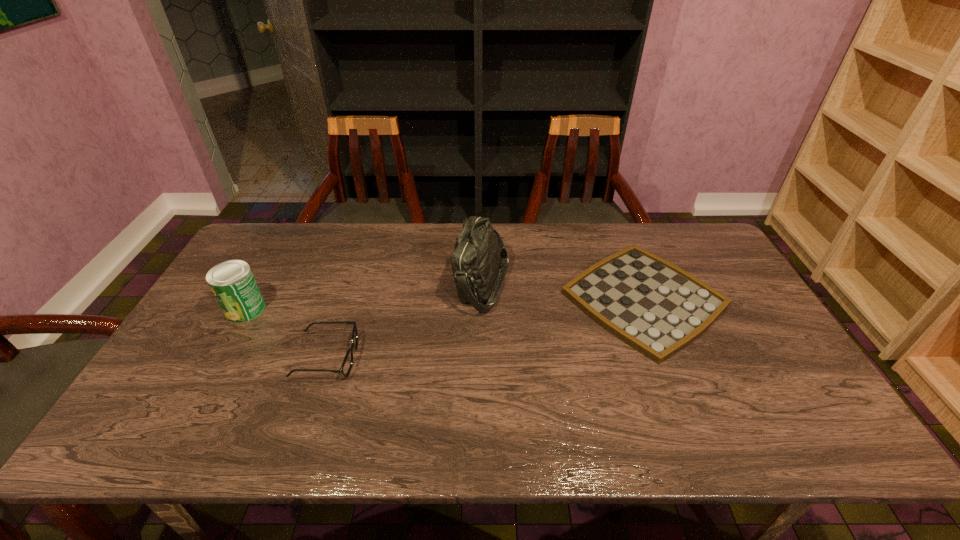
Locate an element on the screen. vacant space in between the second shortest object and the checkerboard is located at coordinates (485, 328).

This screenshot has height=540, width=960. Find the location of `free area in between the leftmost object and the shoulder bag`. free area in between the leftmost object and the shoulder bag is located at coordinates (364, 296).

Image resolution: width=960 pixels, height=540 pixels. Find the location of `free spot between the tallest object and the spectacles`. free spot between the tallest object and the spectacles is located at coordinates (404, 320).

You are a GUI agent. You are given a task and a screenshot of the screen. Output one action in this format:
    pyautogui.click(x=<x>, y=<y>)
    Task: Click on the blank region between the second shortest object and the can
    This screenshot has width=960, height=540.
    Given the screenshot: What is the action you would take?
    pyautogui.click(x=286, y=333)

Locate an element on the screen. The image size is (960, 540). object that is the third closest to the shortest object is located at coordinates (232, 282).

Identify the location of the third closest object to the rightmost object. [x=232, y=282].

You are a GUI agent. You are given a task and a screenshot of the screen. Output one action in this format:
    pyautogui.click(x=<x>, y=<y>)
    Task: Click on the vacant area that satisfies the following two spatial constraints: 1. on the back side of the shortest object; 2. at the front padded panel of the second object from right to left
    
    Given the screenshot: What is the action you would take?
    pyautogui.click(x=637, y=284)

Locate an element on the screen. The height and width of the screenshot is (540, 960). free location that satisfies the following two spatial constraints: 1. on the back side of the shortest object; 2. at the front padded panel of the second object from right to left is located at coordinates (637, 284).

Locate an element on the screen. This screenshot has width=960, height=540. free space that satisfies the following two spatial constraints: 1. at the front padded panel of the checkerboard; 2. on the right side of the third object from left to right is located at coordinates (482, 299).

Where is `vacant position in the image that satisfies the following two spatial constraints: 1. at the front padded panel of the shoulder bag; 2. on the front side of the leftmost object`? Image resolution: width=960 pixels, height=540 pixels. vacant position in the image that satisfies the following two spatial constraints: 1. at the front padded panel of the shoulder bag; 2. on the front side of the leftmost object is located at coordinates (483, 309).